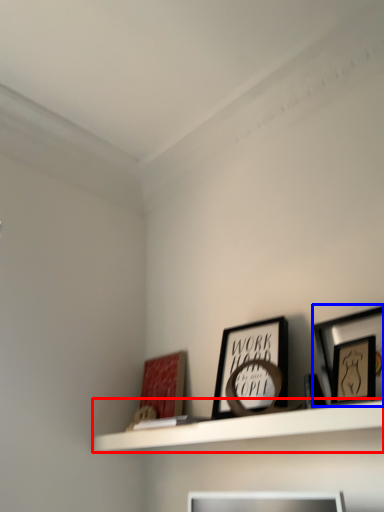
Question: Which object is further to the camera taking this photo, shelf (highlighted by a red box) or picture frame (highlighted by a blue box)?

Choices:
 (A) shelf
 (B) picture frame

Answer: (B)